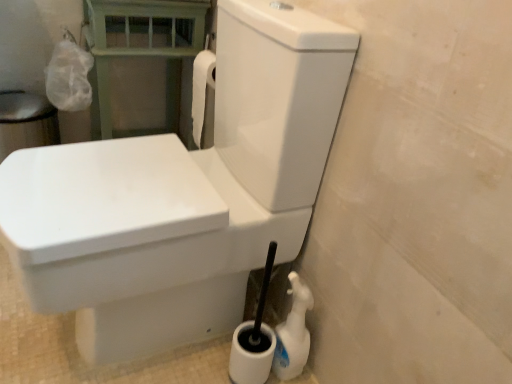
Measure the distance between point (295, 354) and camera.

The distance of point (295, 354) from camera is 39.25 inches.

The width and height of the screenshot is (512, 384). Describe the element at coordinates (293, 332) in the screenshot. I see `white plastic spray bottle at lower right` at that location.

The image size is (512, 384). What do you see at coordinates (183, 194) in the screenshot? I see `white glossy toilet at center` at bounding box center [183, 194].

Where is `white plastic spray bottle at lower right`? The width and height of the screenshot is (512, 384). white plastic spray bottle at lower right is located at coordinates (293, 332).

Is green painted wood balustrade at upper left oriented away from white plastic spray bottle at lower right?

No, green painted wood balustrade at upper left is not facing the opposite direction of white plastic spray bottle at lower right.

Is green painted wood balustrade at upper left thinner than white plastic spray bottle at lower right?

Incorrect, the width of green painted wood balustrade at upper left is not less than that of white plastic spray bottle at lower right.

Where is `cleaning product below the green painted wood balustrade at upper left (from a real-world perspective)`? This screenshot has height=384, width=512. cleaning product below the green painted wood balustrade at upper left (from a real-world perspective) is located at coordinates (293, 332).

Between white plastic spray bottle at lower right and green painted wood balustrade at upper left, which one appears on the left side from the viewer's perspective?

green painted wood balustrade at upper left is more to the left.

From a real-world perspective, between white plastic spray bottle at lower right and green painted wood balustrade at upper left, who is vertically lower?

white plastic spray bottle at lower right, from a real-world perspective.

Which object is closer to the camera, white plastic spray bottle at lower right or green painted wood balustrade at upper left?

Positioned in front is white plastic spray bottle at lower right.

Considering the sizes of objects white plastic spray bottle at lower right and green painted wood balustrade at upper left in the image provided, who is smaller, white plastic spray bottle at lower right or green painted wood balustrade at upper left?

white plastic spray bottle at lower right is smaller.

Who is bigger, white glossy toilet at center or green painted wood balustrade at upper left?

With larger size is white glossy toilet at center.

In the scene shown: Could green painted wood balustrade at upper left be considered to be inside white glossy toilet at center?

That's incorrect, green painted wood balustrade at upper left is not inside white glossy toilet at center.

Is white glossy toilet at center wider or thinner than green painted wood balustrade at upper left?

Considering their sizes, white glossy toilet at center looks broader than green painted wood balustrade at upper left.

Which is in front, point (159, 254) or point (122, 1)?

The point (159, 254) is in front.

Looking at this image, from a real-world perspective, which object rests below the other?

white plastic spray bottle at lower right is physically lower.

Is white plastic spray bottle at lower right not near white glossy toilet at center?

No, white plastic spray bottle at lower right is in close proximity to white glossy toilet at center.

Who is smaller, white plastic spray bottle at lower right or white glossy toilet at center?

With smaller size is white plastic spray bottle at lower right.

Between white plastic spray bottle at lower right and white glossy toilet at center, which one is positioned in front?

white glossy toilet at center is more forward.

Identify the location of toilet that appears on the right of green painted wood balustrade at upper left. (183, 194).

Is white glossy toilet at center surrounded by green painted wood balustrade at upper left?

No, white glossy toilet at center is not surrounded by green painted wood balustrade at upper left.

Considering the sizes of objects green painted wood balustrade at upper left and white glossy toilet at center in the image provided, who is shorter, green painted wood balustrade at upper left or white glossy toilet at center?

With less height is green painted wood balustrade at upper left.

Between green painted wood balustrade at upper left and white glossy toilet at center, which one has larger size?

white glossy toilet at center.

Is white glossy toilet at center positioned behind white plastic spray bottle at lower right?

No, white glossy toilet at center is closer to the camera.

From a real-world perspective, which object stands above the other?

white glossy toilet at center is physically above.

Are white glossy toilet at center and white plastic spray bottle at lower right beside each other?

white glossy toilet at center and white plastic spray bottle at lower right are clearly separated.

The image size is (512, 384). In order to click on balustrade positioned vertically above the white plastic spray bottle at lower right (from a real-world perspective) in this screenshot , I will do `click(141, 50)`.

Identify the location of cleaning product below the green painted wood balustrade at upper left (from a real-world perspective). This screenshot has height=384, width=512. (293, 332).

Based on their spatial positions, is green painted wood balustrade at upper left or white plastic spray bottle at lower right closer to white glossy toilet at center?

white plastic spray bottle at lower right is closer to white glossy toilet at center.

Considering their positions, is white plastic spray bottle at lower right positioned further to green painted wood balustrade at upper left than white glossy toilet at center?

white plastic spray bottle at lower right.

Considering their positions, is white plastic spray bottle at lower right positioned closer to white glossy toilet at center than green painted wood balustrade at upper left?

white plastic spray bottle at lower right.

From the image, which object appears to be nearer to green painted wood balustrade at upper left, white glossy toilet at center or white plastic spray bottle at lower right?

The object closer to green painted wood balustrade at upper left is white glossy toilet at center.

From the image, which object appears to be nearer to white plastic spray bottle at lower right, green painted wood balustrade at upper left or white glossy toilet at center?

white glossy toilet at center is closer to white plastic spray bottle at lower right.

Based on their spatial positions, is white glossy toilet at center or green painted wood balustrade at upper left further from white plastic spray bottle at lower right?

The object further to white plastic spray bottle at lower right is green painted wood balustrade at upper left.

Locate an element on the screen. Image resolution: width=512 pixels, height=384 pixels. toilet between green painted wood balustrade at upper left and white plastic spray bottle at lower right vertically is located at coordinates (183, 194).